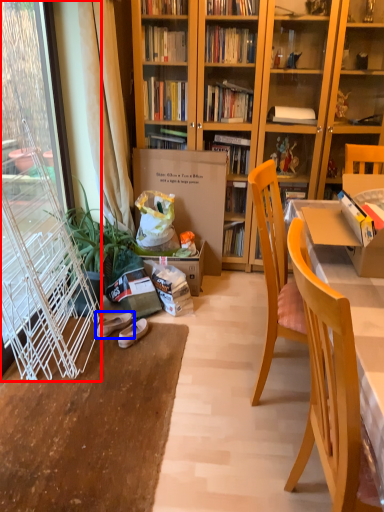
Question: Which of the following is the farthest to the observer, screen door (highlighted by a red box) or footwear (highlighted by a blue box)?

Choices:
 (A) screen door
 (B) footwear

Answer: (B)